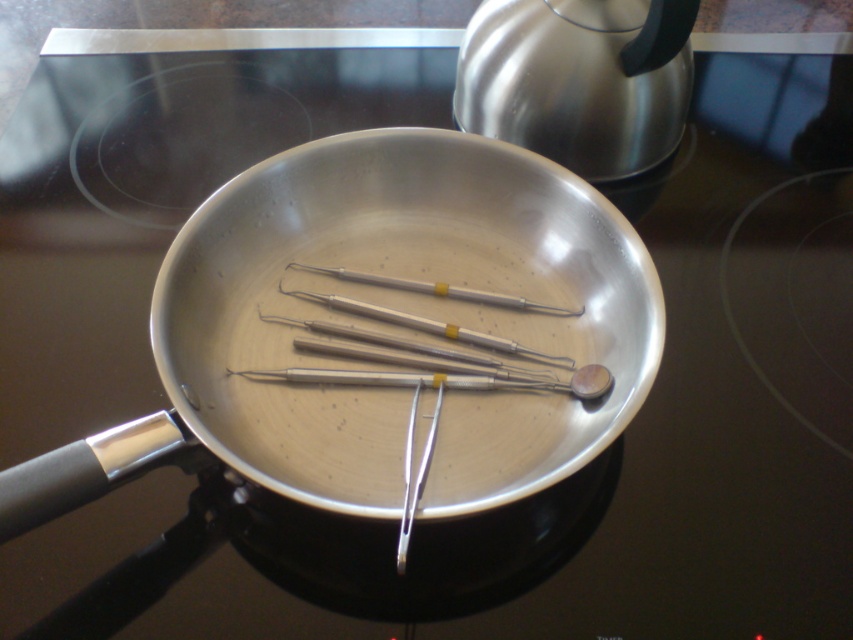
You are a kitchen assistant and need to place both the brushed metal teapot at upper right and the satin silver metal probe at center onto a shelf. The shelf has a maximum weight capacity of 5 kilograms. If the teapot weighs 3 kilograms and the probe weighs 1 kilogram, can both items be placed on the shelf together?

The brushed metal teapot at upper right weighs 3 kilograms and the satin silver metal probe at center weighs 1 kilogram. Combined, they total 4 kilograms, which is under the 5 kilogram limit. Therefore, both items can safely be placed on the shelf together.

What object is located at the coordinate point (578, 80) in the image?

The brushed metal teapot at upper right is located at the coordinate point (578, 80).

You are a chef trying to reach the satin silver metal probe at center to check the temperature of the pan. There is a brushed metal teapot at upper right in the way. Can you move the probe without moving the teapot?

The brushed metal teapot at upper right is further to the viewer than the satin silver metal probe at center, so the probe is closer. Therefore, you can reach and move the probe without disturbing the teapot.